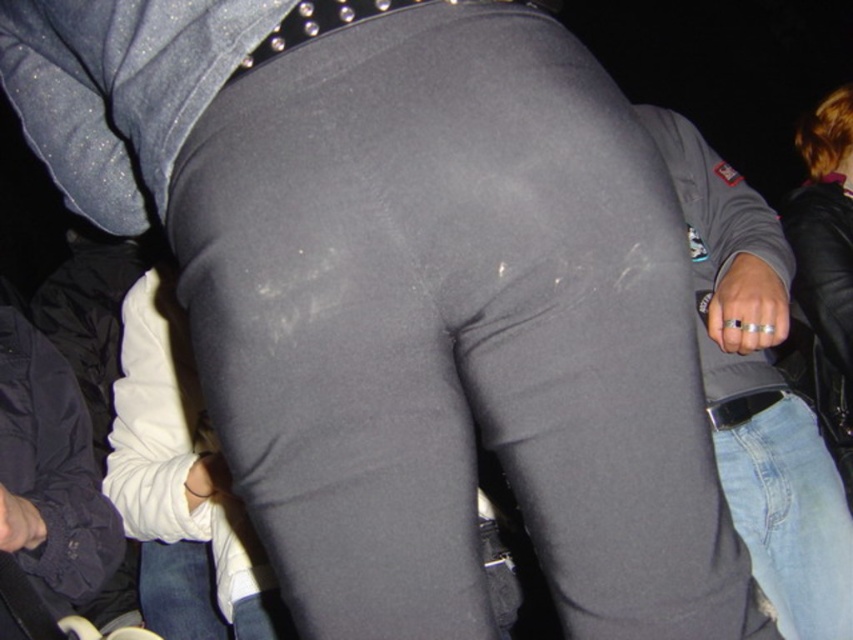
Question: Estimate the real-world distances between objects in this image. Which object is farther from the black leather belt at center?

Choices:
 (A) dark blue fabric pants at lower left
 (B) jeans at lower left
 (C) light blue denim jeans at lower right
 (D) leather jacket at upper right

Answer: (A)

Question: Is gray matte leggings at center closer to camera compared to denim jeans at right?

Choices:
 (A) yes
 (B) no

Answer: (A)

Question: Is the position of gray matte pants at center more distant than that of jeans at lower left?

Choices:
 (A) no
 (B) yes

Answer: (B)

Question: Does gray matte leggings at center appear over light blue denim jeans at lower right?

Choices:
 (A) no
 (B) yes

Answer: (B)

Question: Which point appears farthest from the camera in this image?

Choices:
 (A) (714, 429)
 (B) (830, 508)
 (C) (675, 440)
 (D) (149, 541)

Answer: (D)

Question: Which of these objects is positioned farthest from the dark blue fabric pants at lower left?

Choices:
 (A) gray matte leggings at center
 (B) jeans at lower left
 (C) black leather belt at center
 (D) denim jeans at right

Answer: (D)